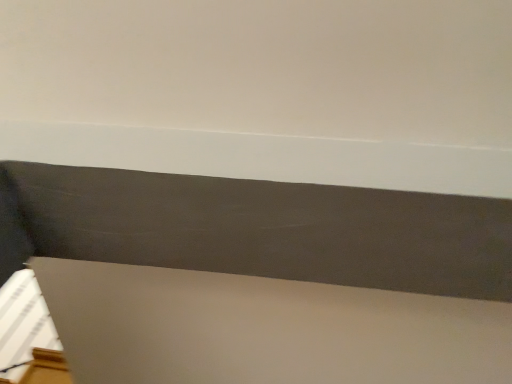
Describe the element at coordinates (261, 278) in the screenshot. I see `matte gray board at lower center` at that location.

The height and width of the screenshot is (384, 512). In order to click on matte gray board at lower center in this screenshot , I will do `click(261, 278)`.

At what (x,y) coordinates should I click in order to perform the action: click on matte gray board at lower center. Please return your answer as a coordinate pair (x, y). Image resolution: width=512 pixels, height=384 pixels. Looking at the image, I should click on (261, 278).